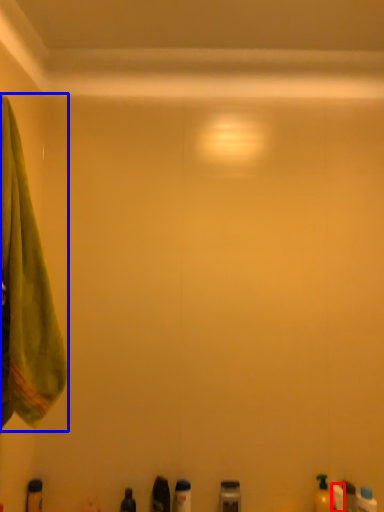
Question: Which object is further to the camera taking this photo, toiletry (highlighted by a red box) or towel (highlighted by a blue box)?

Choices:
 (A) toiletry
 (B) towel

Answer: (A)